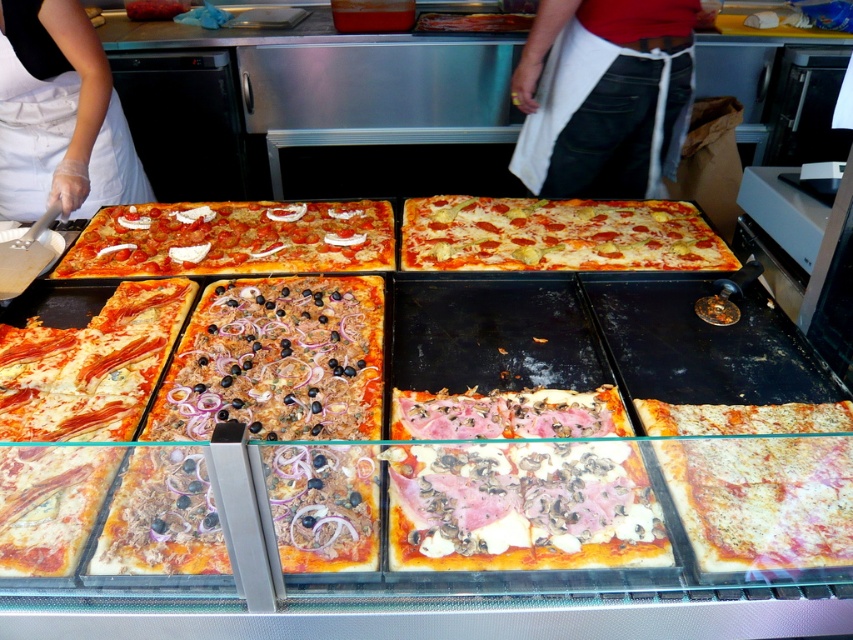
Does white creamy cheese at center appear under white apron at left?

Correct, white creamy cheese at center is located below white apron at left.

Does white creamy cheese at center lie behind white apron at left?

No, it is in front of white apron at left.

What do you see at coordinates (521, 506) in the screenshot?
I see `white creamy cheese at center` at bounding box center [521, 506].

Locate an element on the screen. The width and height of the screenshot is (853, 640). white creamy cheese at center is located at coordinates (521, 506).

Is white apron at center below cheesy pizza at center?

Incorrect, white apron at center is not positioned below cheesy pizza at center.

Who is more forward, (581,157) or (679,234)?

Point (679,234) is more forward.

I want to click on white apron at center, so click(x=602, y=96).

This screenshot has width=853, height=640. What do you see at coordinates (329, 506) in the screenshot?
I see `white cheese pizza at center` at bounding box center [329, 506].

Which of these two, white cheese pizza at center or white apron at left, stands taller?

white apron at left is taller.

What do you see at coordinates (329, 506) in the screenshot?
I see `white cheese pizza at center` at bounding box center [329, 506].

Identify the location of white cheese pizza at center. (329, 506).